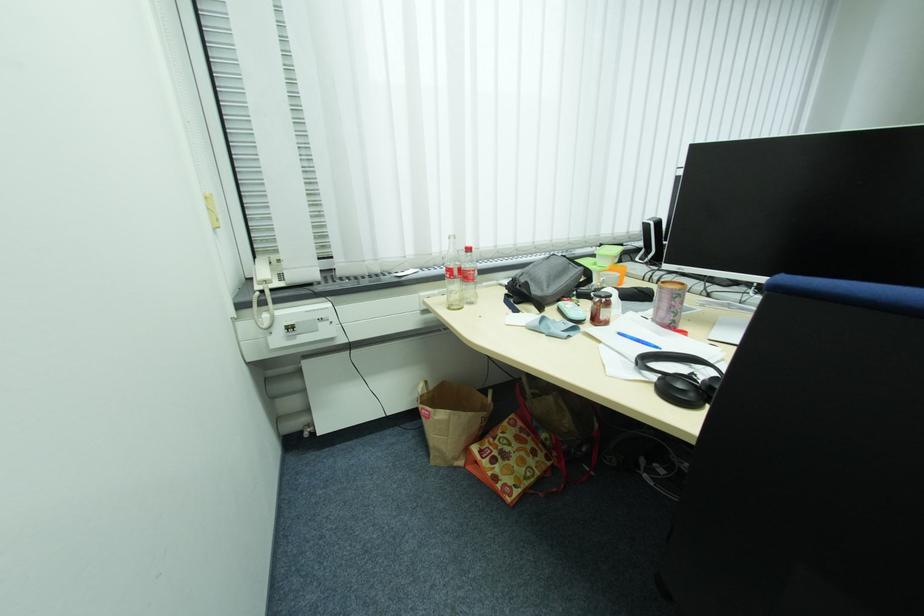
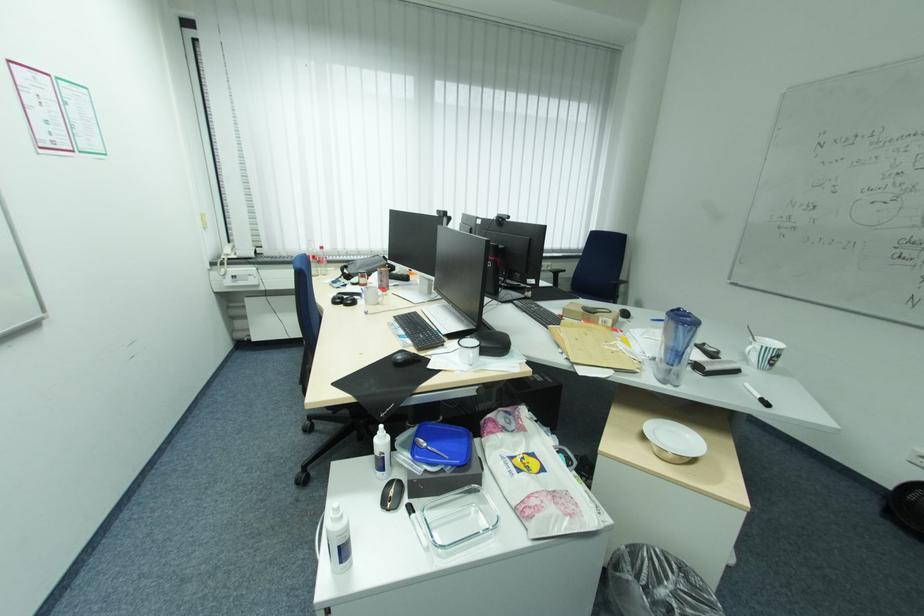
Find the pixel in the second image that matches point 273,282 in the first image.

(234, 254)